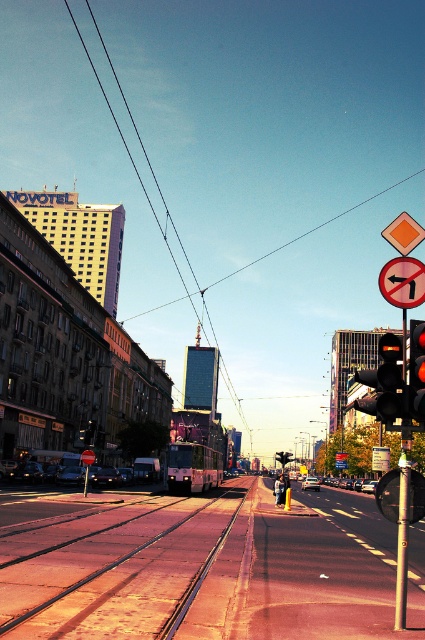
Is black wire at upper center below red glass traffic light at right?

No, black wire at upper center is not below red glass traffic light at right.

Does black wire at upper center come in front of red glass traffic light at right?

No, black wire at upper center is further to the viewer.

Does point (110, 113) come behind point (416, 403)?

Yes.

Locate an element on the screen. The image size is (425, 640). black wire at upper center is located at coordinates (133, 163).

This screenshot has width=425, height=640. Describe the element at coordinates (133, 570) in the screenshot. I see `metallic tram tracks at center` at that location.

How far apart are metallic tram tracks at center and black wire at upper center?

The distance of metallic tram tracks at center from black wire at upper center is 230.75 meters.

Between point (220, 620) and point (91, 67), which one is positioned in front?

Point (220, 620)

This screenshot has width=425, height=640. I want to click on metallic tram tracks at center, so click(x=133, y=570).

Which is more to the left, metallic tram tracks at center or metallic pole at right?

metallic tram tracks at center is more to the left.

Can you confirm if metallic tram tracks at center is positioned to the left of metallic pole at right?

Yes, metallic tram tracks at center is to the left of metallic pole at right.

Which is in front, point (150, 531) or point (397, 572)?

Point (397, 572) is more forward.

The image size is (425, 640). In order to click on metallic tram tracks at center in this screenshot , I will do `click(133, 570)`.